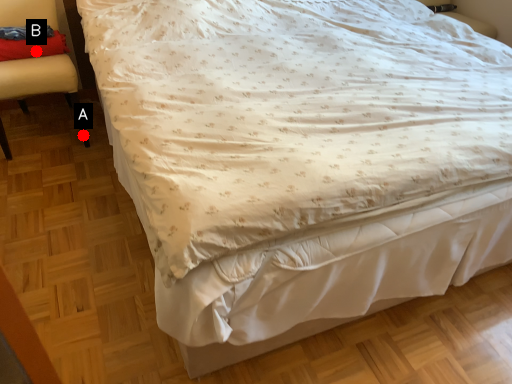
Question: Two points are circled on the image, labeled by A and B beside each circle. Which point is farther to the camera?

Choices:
 (A) A is further
 (B) B is further

Answer: (A)